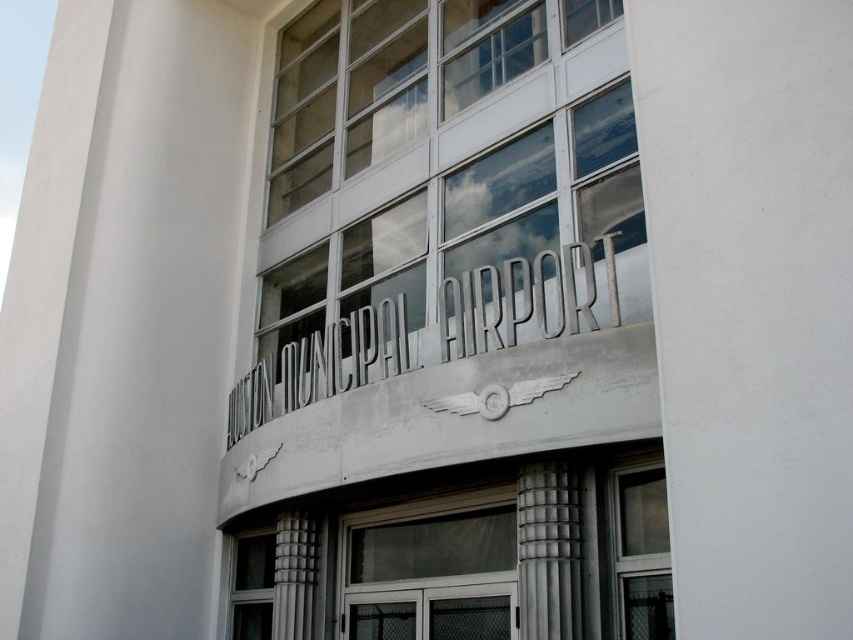
Question: Can you confirm if clear glass windows at center is positioned above gray concrete column at right?

Choices:
 (A) yes
 (B) no

Answer: (A)

Question: Which object is closer to the camera taking this photo?

Choices:
 (A) clear glass window at center
 (B) clear glass door at center
 (C) gray concrete column at right

Answer: (A)

Question: Which object is the farthest from the clear glass door at center?

Choices:
 (A) clear glass window at center
 (B) clear glass windows at center

Answer: (B)

Question: Which point is closer to the camera?

Choices:
 (A) (430, 604)
 (B) (641, 461)
 (C) (548, 470)
 (D) (538, 212)

Answer: (C)

Question: Does clear glass door at center lie behind clear glass window at center?

Choices:
 (A) no
 (B) yes

Answer: (B)

Question: Is clear glass windows at center to the left of clear glass door at center from the viewer's perspective?

Choices:
 (A) no
 (B) yes

Answer: (B)